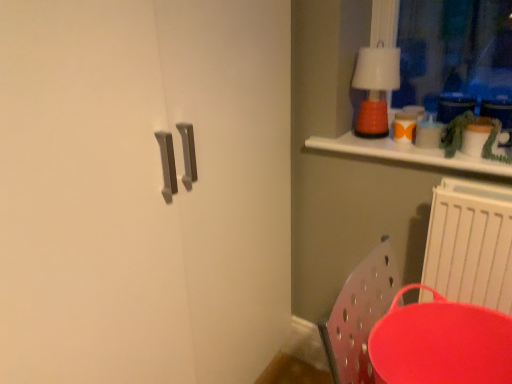
Question: From a real-world perspective, is matte red tray at lower right over white plastic radiator at lower right?

Choices:
 (A) no
 (B) yes

Answer: (A)

Question: Is matte red tray at lower right with white plastic radiator at lower right?

Choices:
 (A) yes
 (B) no

Answer: (B)

Question: Does matte red tray at lower right have a lesser width compared to white plastic radiator at lower right?

Choices:
 (A) no
 (B) yes

Answer: (A)

Question: Is matte red tray at lower right facing away from white plastic radiator at lower right?

Choices:
 (A) yes
 (B) no

Answer: (A)

Question: From the image's perspective, is matte red tray at lower right under white plastic radiator at lower right?

Choices:
 (A) no
 (B) yes

Answer: (B)

Question: Considering the relative sizes of matte red tray at lower right and white plastic radiator at lower right in the image provided, is matte red tray at lower right wider than white plastic radiator at lower right?

Choices:
 (A) yes
 (B) no

Answer: (A)

Question: Is the position of white plastic radiator at lower right less distant than that of orange matte lamp at upper right?

Choices:
 (A) yes
 (B) no

Answer: (A)

Question: Does white plastic radiator at lower right appear on the left side of orange matte lamp at upper right?

Choices:
 (A) no
 (B) yes

Answer: (A)

Question: Could you tell me if white plastic radiator at lower right is turned towards orange matte lamp at upper right?

Choices:
 (A) no
 (B) yes

Answer: (A)

Question: From a real-world perspective, is white plastic radiator at lower right below orange matte lamp at upper right?

Choices:
 (A) yes
 (B) no

Answer: (A)

Question: From the image's perspective, is white plastic radiator at lower right on orange matte lamp at upper right?

Choices:
 (A) yes
 (B) no

Answer: (B)

Question: Considering the relative positions of white plastic radiator at lower right and orange matte lamp at upper right in the image provided, is white plastic radiator at lower right behind orange matte lamp at upper right?

Choices:
 (A) yes
 (B) no

Answer: (B)

Question: Considering the relative sizes of orange matte lamp at upper right and white plastic radiator at lower right in the image provided, is orange matte lamp at upper right bigger than white plastic radiator at lower right?

Choices:
 (A) yes
 (B) no

Answer: (B)